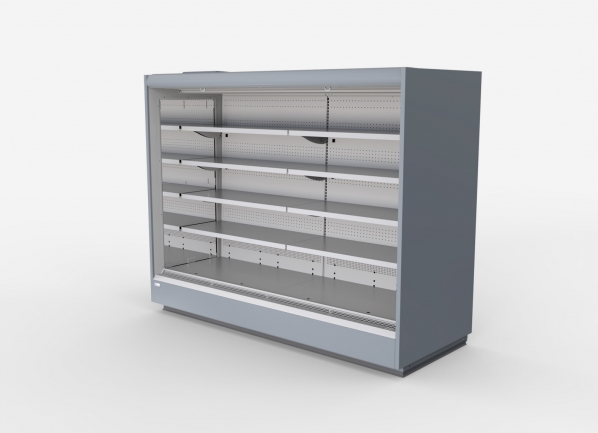
Find the location of a particular element. The width and height of the screenshot is (598, 433). third shelf is located at coordinates [274, 206].